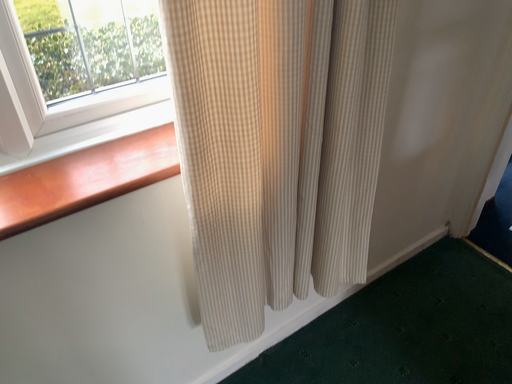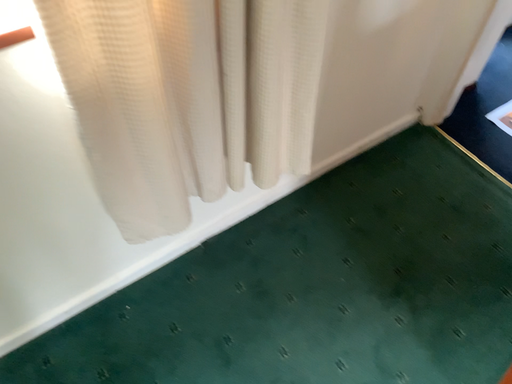
Question: Which way did the camera rotate in the video?

Choices:
 (A) rotated downward
 (B) rotated upward

Answer: (A)